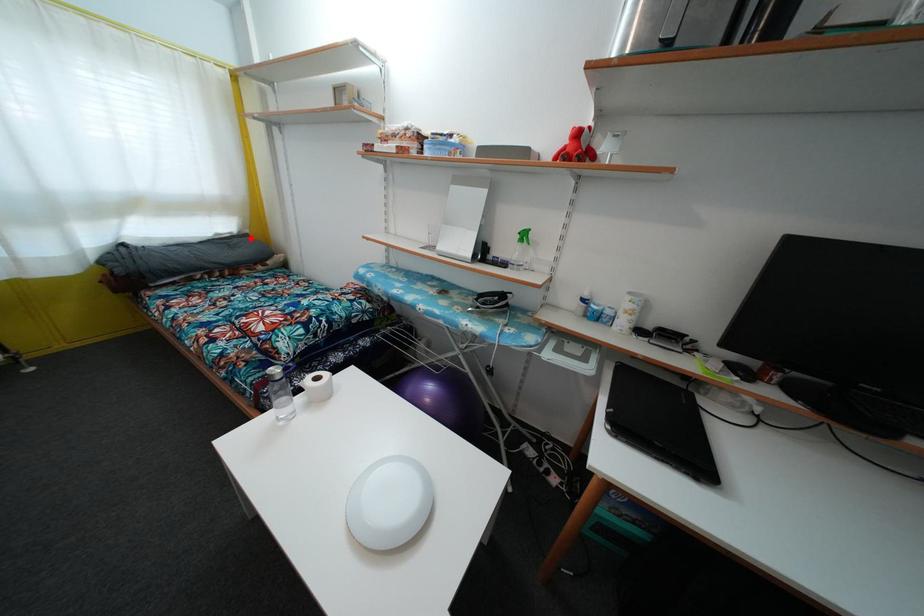
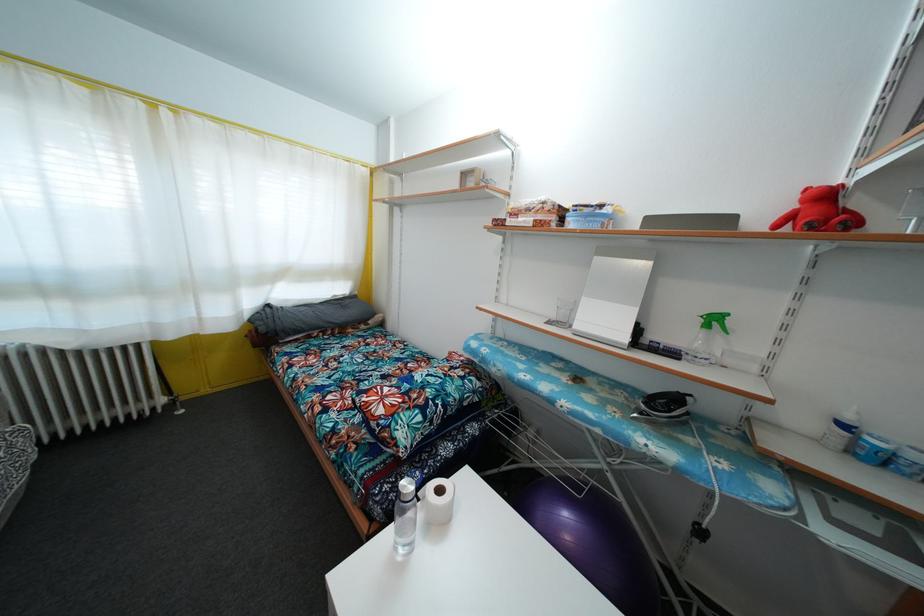
In the second image, find the point that corresponds to the highlighted location in the first image.

(359, 300)